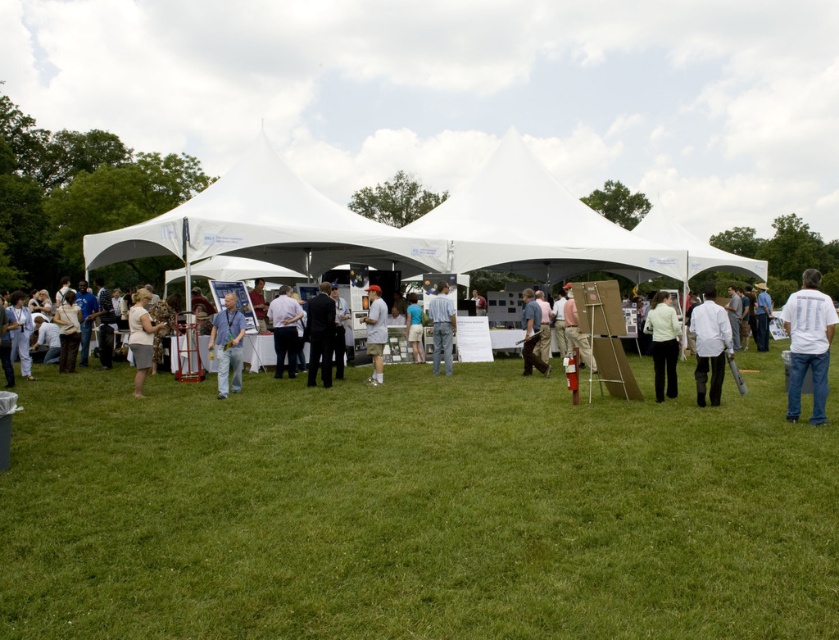
Can you confirm if white cotton shirt at center is positioned to the left of light blue denim jeans at center?

In fact, white cotton shirt at center is to the right of light blue denim jeans at center.

Does white cotton shirt at center have a lesser width compared to light blue denim jeans at center?

In fact, white cotton shirt at center might be wider than light blue denim jeans at center.

This screenshot has height=640, width=839. Describe the element at coordinates (425, 467) in the screenshot. I see `white cotton shirt at center` at that location.

What are the coordinates of `white cotton shirt at center` in the screenshot? It's located at (425, 467).

Does light gray fabric shirt at center have a greater height compared to light beige fabric bag at left?

Yes, light gray fabric shirt at center is taller than light beige fabric bag at left.

Does light gray fabric shirt at center have a larger size compared to light beige fabric bag at left?

Actually, light gray fabric shirt at center might be smaller than light beige fabric bag at left.

Where is `light gray fabric shirt at center`? The height and width of the screenshot is (640, 839). light gray fabric shirt at center is located at coordinates (374, 332).

Who is positioned more to the left, white fabric canopy at upper left or light gray fabric shirt at center?

From the viewer's perspective, white fabric canopy at upper left appears more on the left side.

Does point (191, 257) come in front of point (379, 378)?

No, it is behind (379, 378).

The height and width of the screenshot is (640, 839). I want to click on white fabric canopy at upper left, so click(x=268, y=227).